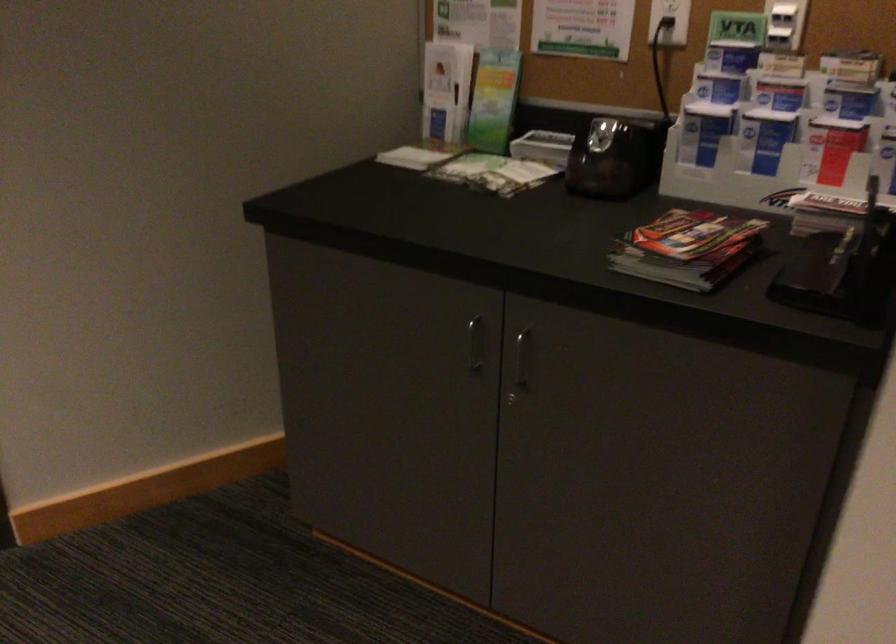
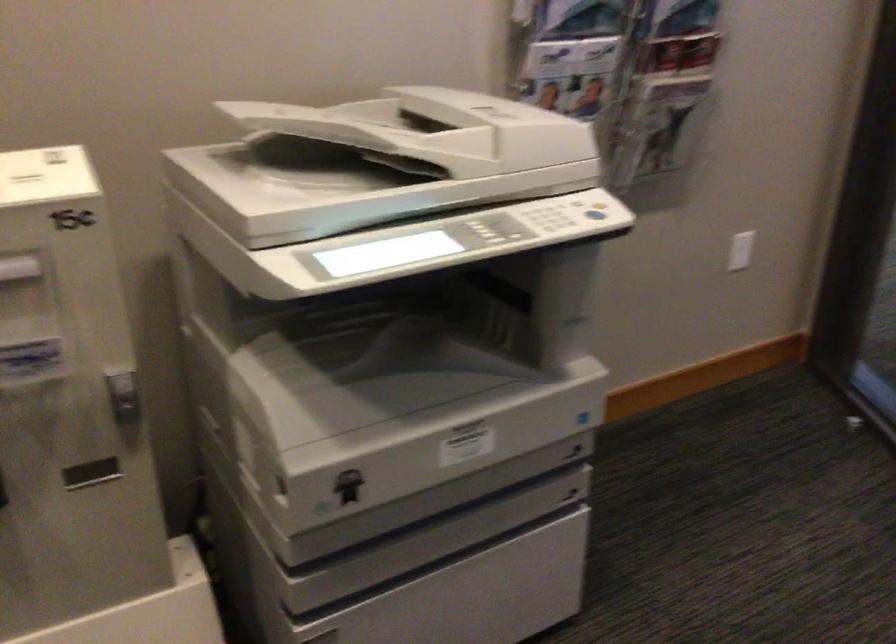
The first image is from the beginning of the video and the second image is from the end. How did the camera likely rotate when shooting the video?

The camera rotated toward left-down.